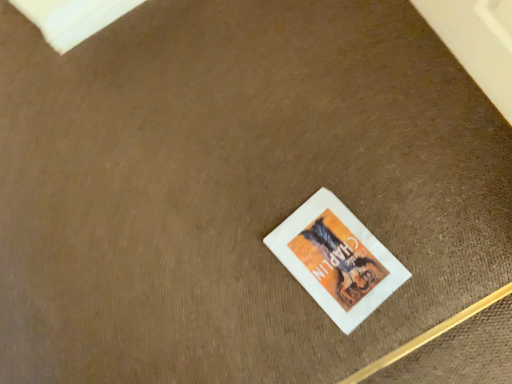
Locate an element on the screen. The width and height of the screenshot is (512, 384). blank space situated above white paper book at center (from a real-world perspective) is located at coordinates (334, 254).